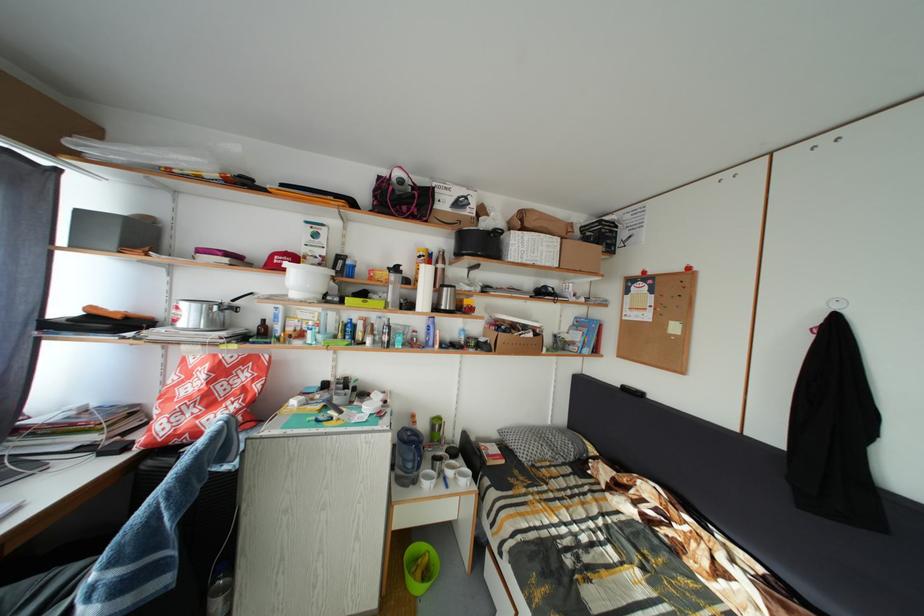
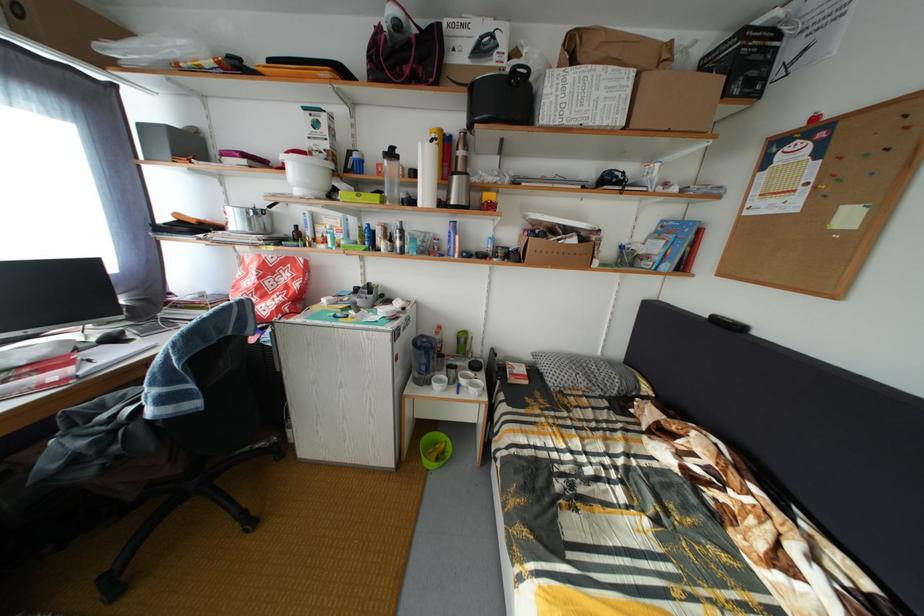
Where in the second image is the point corresponding to point 381,281 from the first image?

(388, 176)